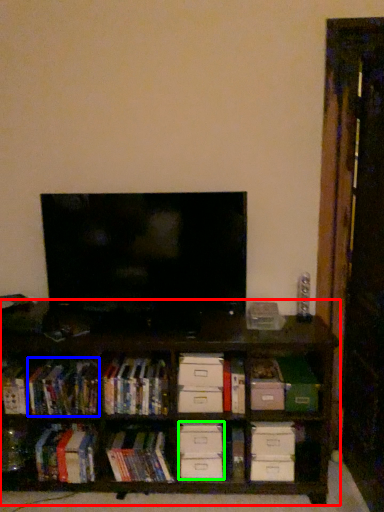
Question: Considering the real-world distances, which object is farthest from shelf (highlighted by a red box)? book (highlighted by a blue box) or drawer (highlighted by a green box)?

Choices:
 (A) book
 (B) drawer

Answer: (B)